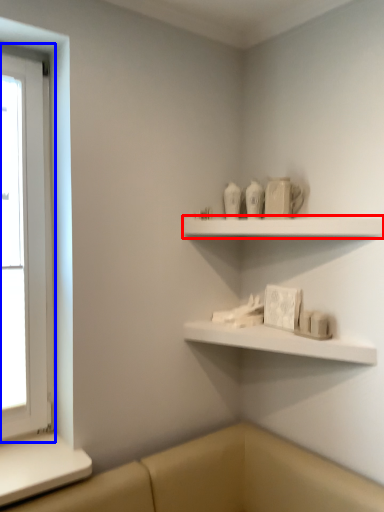
Question: Which of the following is the farthest to the observer, shelf (highlighted by a red box) or window (highlighted by a blue box)?

Choices:
 (A) shelf
 (B) window

Answer: (B)